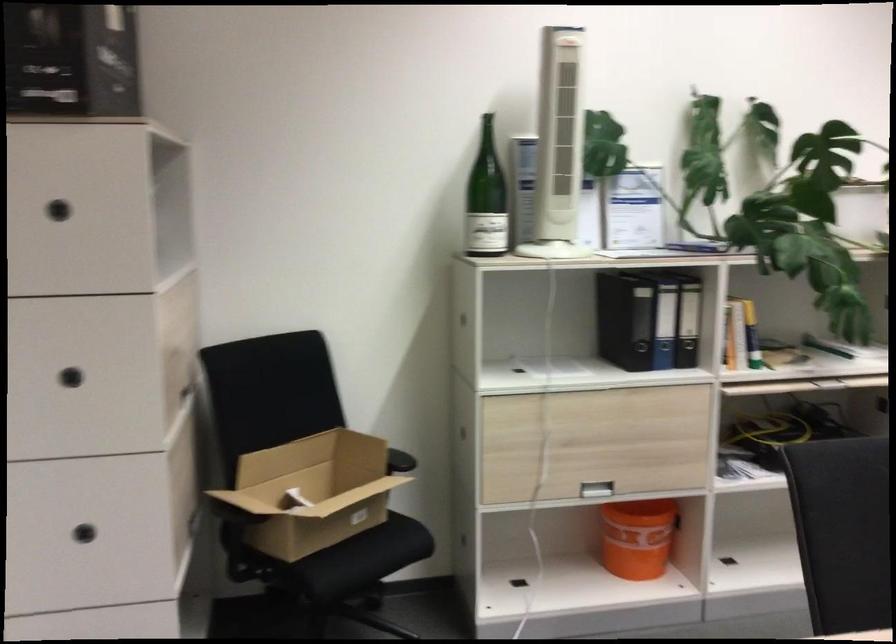
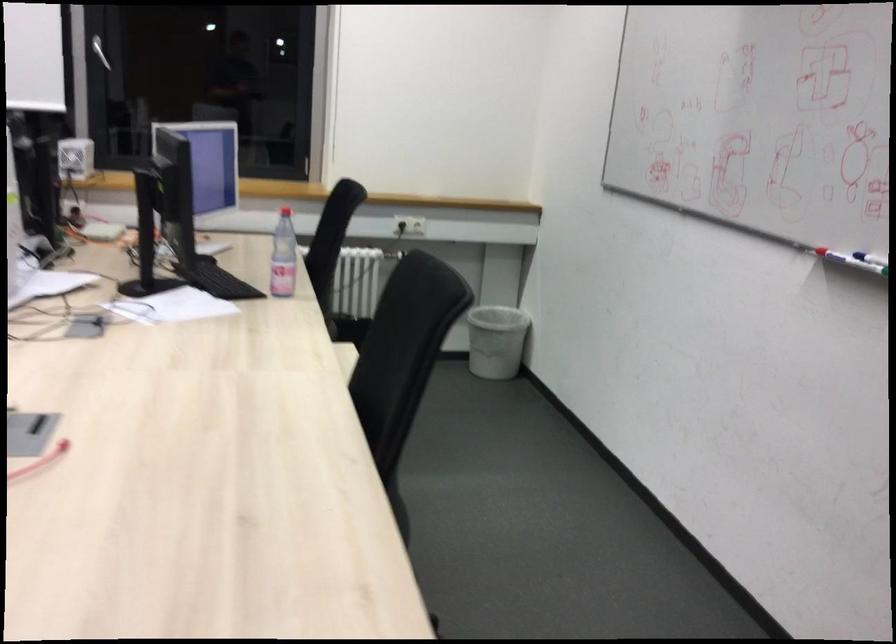
The first image is from the beginning of the video and the second image is from the end. How did the camera likely rotate when shooting the video?

The camera rotated toward right-down.